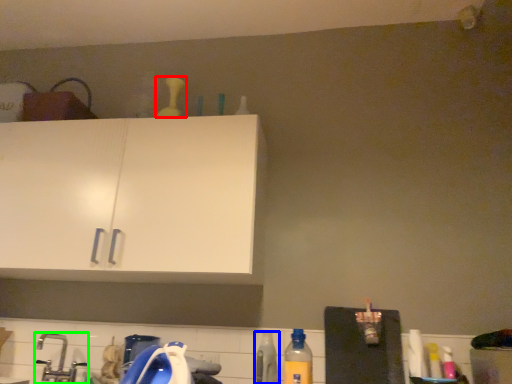
Question: Estimate the real-world distances between objects in this image. Which object is closer to bottle (highlighted by a red box), bottle (highlighted by a blue box) or faucet (highlighted by a green box)?

Choices:
 (A) bottle
 (B) faucet

Answer: (B)